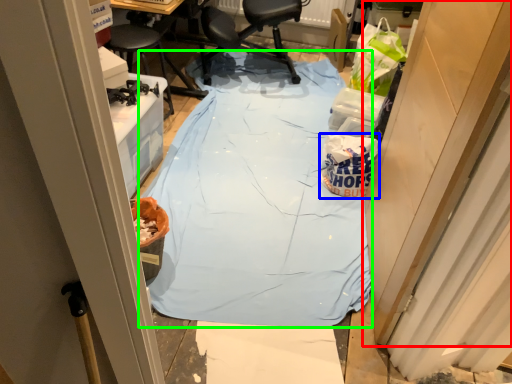
Question: Estimate the real-world distances between objects in this image. Which object is closer to door (highlighted by a red box), waste (highlighted by a blue box) or tablecloth (highlighted by a green box)?

Choices:
 (A) waste
 (B) tablecloth

Answer: (A)